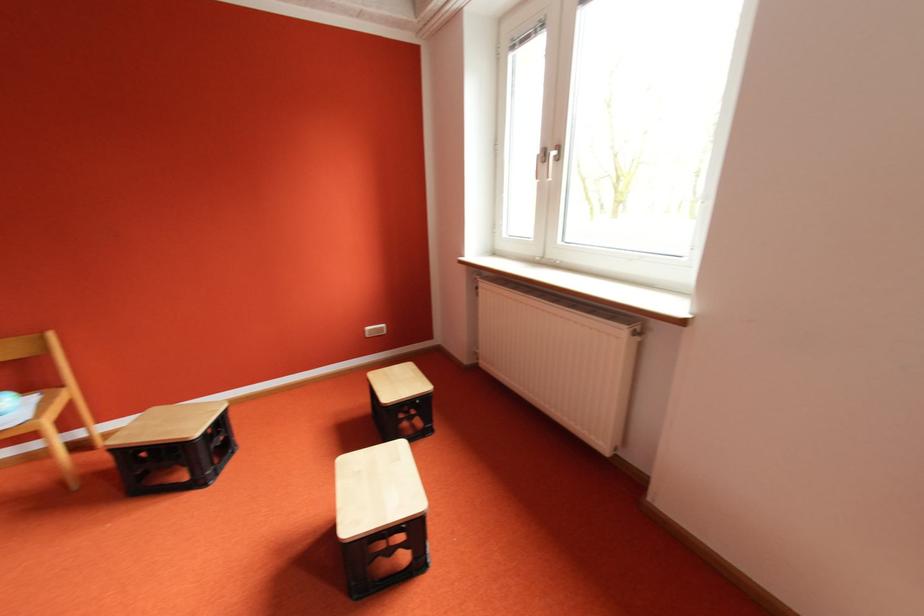
What do you see at coordinates (19, 408) in the screenshot? Image resolution: width=924 pixels, height=616 pixels. I see `a chair sitting surface` at bounding box center [19, 408].